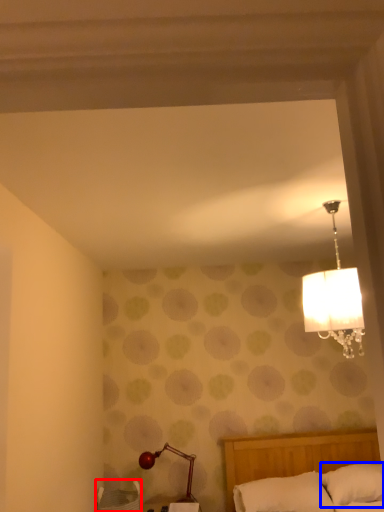
Question: Which point is further to the camera, furniture (highlighted by a red box) or pillow (highlighted by a blue box)?

Choices:
 (A) furniture
 (B) pillow

Answer: (B)